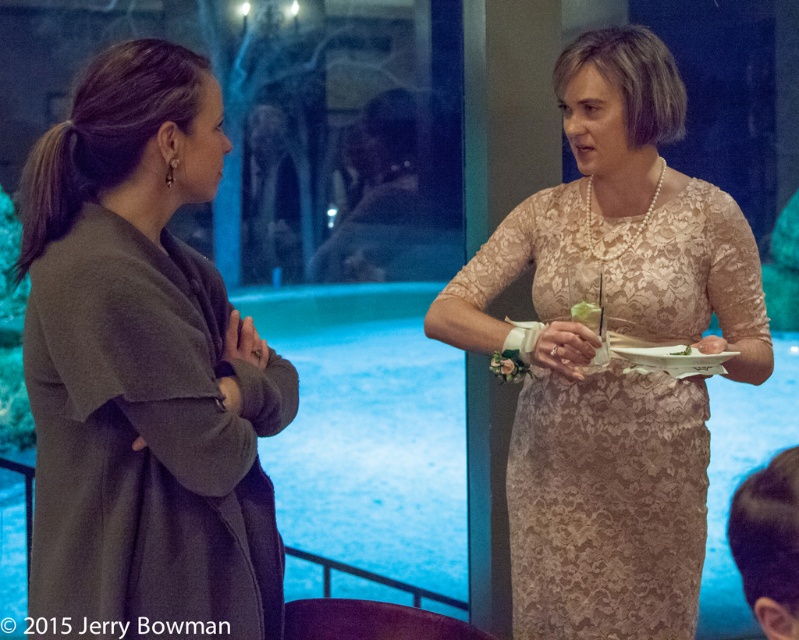
Question: Can you confirm if dark gray wool coat at left is bigger than lace dress at center?

Choices:
 (A) yes
 (B) no

Answer: (B)

Question: Is dark gray wool coat at left bigger than green leafy vegetable at center?

Choices:
 (A) yes
 (B) no

Answer: (A)

Question: In this image, where is dark gray wool coat at left located relative to lace dress at center?

Choices:
 (A) right
 (B) left

Answer: (B)

Question: Which point is closer to the camera?

Choices:
 (A) dark gray wool coat at left
 (B) lace dress at center
 (C) green leafy vegetable at center

Answer: (A)

Question: Estimate the real-world distances between objects in this image. Which object is closer to the lace dress at center?

Choices:
 (A) green leafy vegetable at center
 (B) dark gray wool coat at left

Answer: (A)

Question: Which object appears closest to the camera in this image?

Choices:
 (A) dark gray wool coat at left
 (B) green leafy vegetable at center
 (C) lace dress at center

Answer: (A)